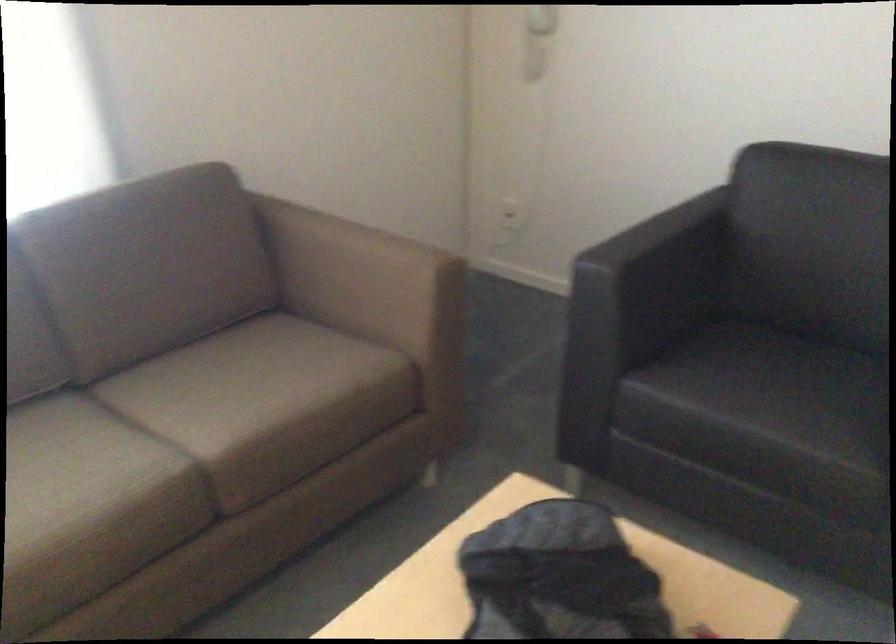
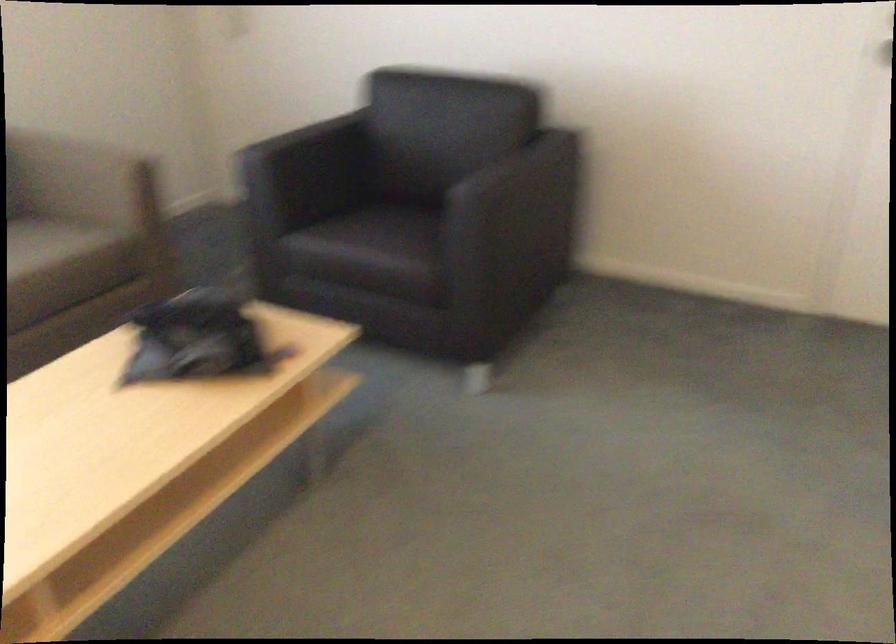
Question: The camera is either moving clockwise (left) or counter-clockwise (right) around the object. The first image is from the beginning of the video and the second image is from the end. Is the camera moving left or right when shooting the video?

Choices:
 (A) Left
 (B) Right

Answer: (A)